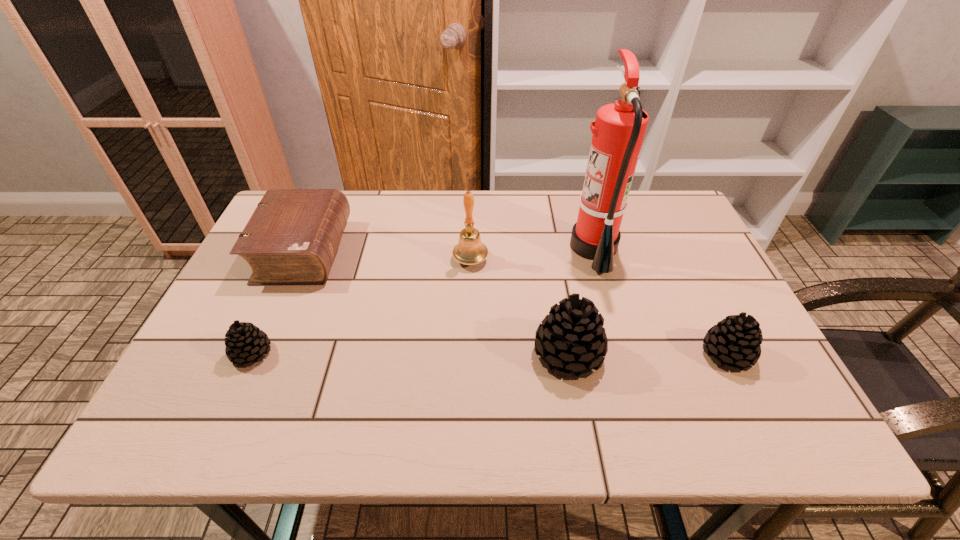
Where is `free space located on the right of the fifth shortest object`? free space located on the right of the fifth shortest object is located at coordinates (564, 260).

Find the location of a particular element. The image size is (960, 540). fire extinguisher that is at the far edge is located at coordinates (619, 129).

Find the location of a particular element. Bible that is positioned at the far edge is located at coordinates [x=292, y=237].

Locate an element on the screen. The width and height of the screenshot is (960, 540). pinecone situated at the left edge is located at coordinates (245, 342).

At what (x,y) coordinates should I click in order to perform the action: click on Bible that is at the left edge. Please return your answer as a coordinate pair (x, y). Image resolution: width=960 pixels, height=540 pixels. Looking at the image, I should click on (292, 237).

The width and height of the screenshot is (960, 540). I want to click on object at the right edge, so click(x=735, y=341).

In order to click on object at the far left corner in this screenshot , I will do point(292,237).

You are a GUI agent. You are given a task and a screenshot of the screen. Output one action in this format:
    pyautogui.click(x=<x>, y=<y>)
    Task: Click on the object positioned at the near left corner
    
    Given the screenshot: What is the action you would take?
    pyautogui.click(x=245, y=342)

I want to click on object located in the near right corner section of the desktop, so click(x=735, y=341).

Find the location of a particular element. This screenshot has height=540, width=960. free space at the far edge is located at coordinates (359, 210).